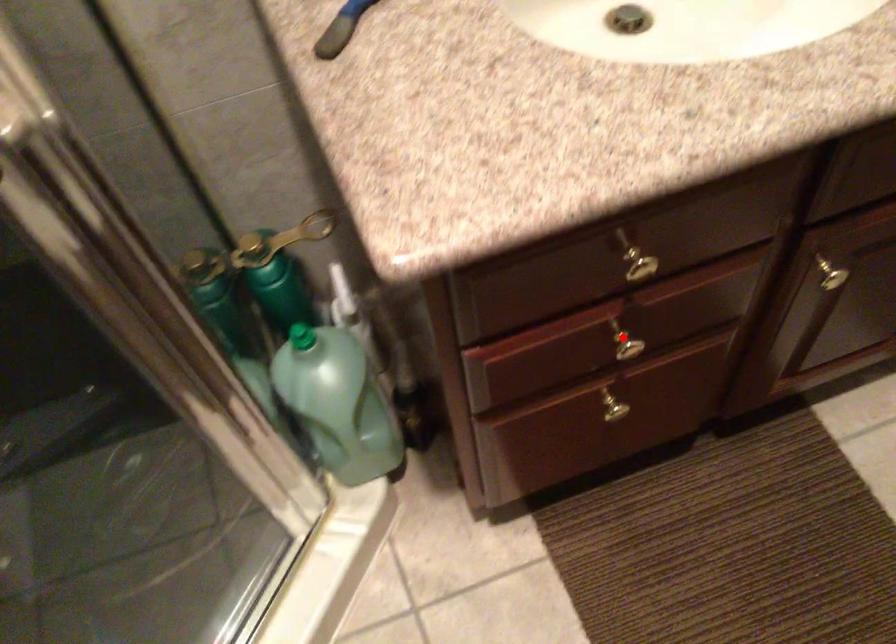
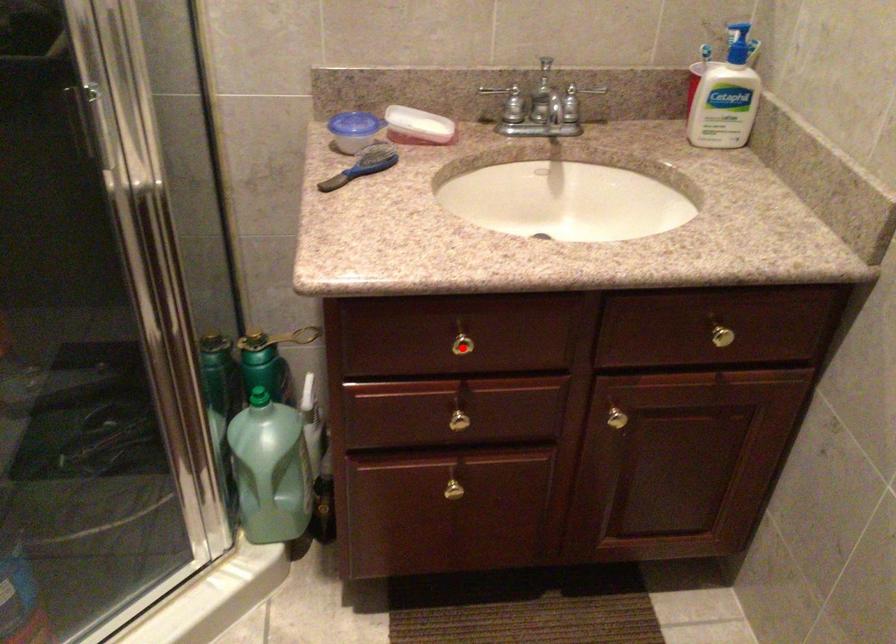
I am providing you with two images of the same scene from different viewpoints. A red point is marked on the first image and another point is marked on the second image. Is the red point in image1 aligned with the point shown in image2?

No